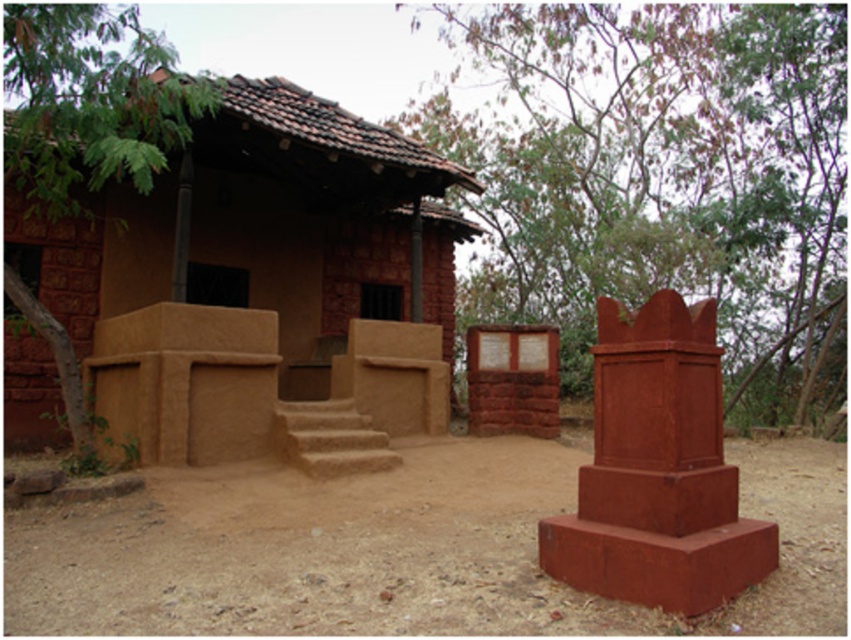
Between green leafy tree at upper right and brown dirt field at center, which one has more height?

With more height is green leafy tree at upper right.

Is green leafy tree at upper right below brown dirt field at center?

Incorrect, green leafy tree at upper right is not positioned below brown dirt field at center.

Between point (755, 170) and point (130, 620), which one is positioned in front?

Point (130, 620) is in front.

This screenshot has height=640, width=851. What are the coordinates of `green leafy tree at upper right` in the screenshot? It's located at (664, 176).

Which is above, green leafy tree at upper right or green leafy tree at upper left?

green leafy tree at upper right is above.

Is green leafy tree at upper right wider than green leafy tree at upper left?

Yes.

Who is more distant from viewer, (821, 8) or (80, 116)?

The point (821, 8) is more distant.

The width and height of the screenshot is (851, 640). What are the coordinates of `green leafy tree at upper right` in the screenshot? It's located at (664, 176).

Is green leafy tree at upper right to the right of brown clay hut at center from the viewer's perspective?

Yes, green leafy tree at upper right is to the right of brown clay hut at center.

Is green leafy tree at upper right bigger than brown clay hut at center?

Yes.

Image resolution: width=851 pixels, height=640 pixels. Identify the location of green leafy tree at upper right. (664, 176).